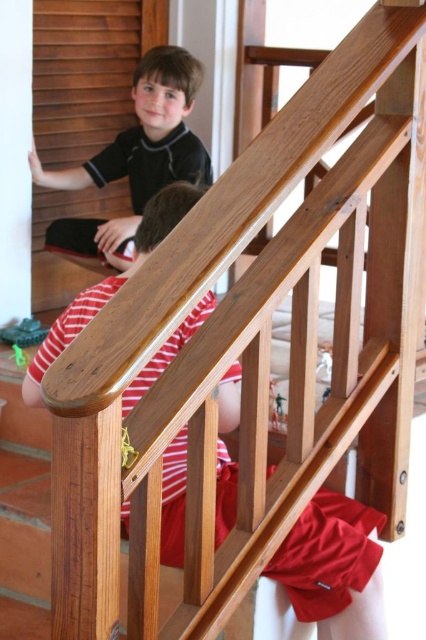
In the scene shown: You are standing at the bottom of the wooden staircase and notice a specific point marked at coordinates (333, 566). According to the scene, where exactly is this point located?

The point at (333, 566) is located on the striped cotton shirt at center.

You are a delivery person who needs to place a package between the striped cotton shirt at center and the matte black shirt at upper left. Can you fit the package there if it requires 1.5 meters of space?

The striped cotton shirt at center and the matte black shirt at upper left are 1.62 meters apart, so yes, the package requiring 1.5 meters of space can fit between them.

You are an interior designer assessing the spatial arrangement of the room. You notice the striped cotton shirt at center and the matte black shirt at upper left. Which of these two shirts is positioned lower in the image?

The striped cotton shirt at center has a lesser height compared to the matte black shirt at upper left, so the striped cotton shirt at center is positioned lower in the image.